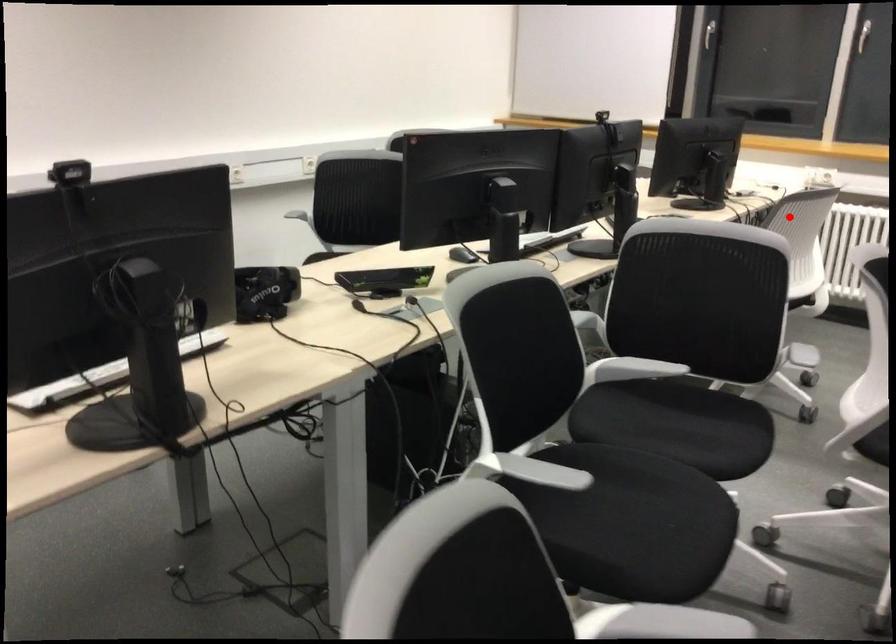
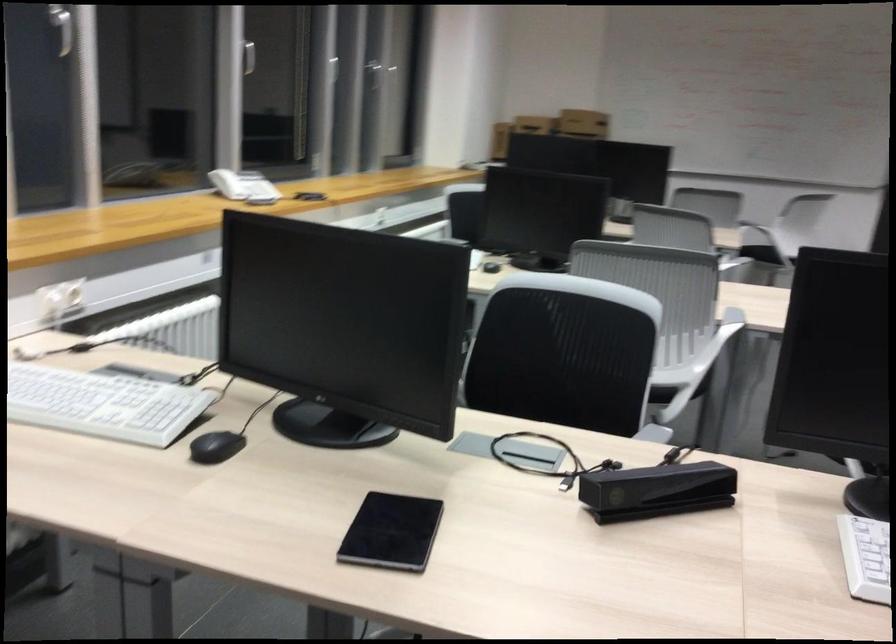
Question: A red point is marked in image1. In image2, is the corresponding 3D point closer to the camera or farther? Reply with the corresponding letter.

Choices:
 (A) The corresponding 3D point is closer.
 (B) The corresponding 3D point is farther.

Answer: (A)